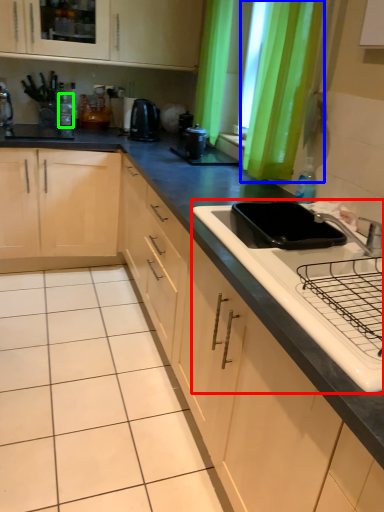
Question: Which object is the closest to the sink (highlighted by a red box)? Choose among these: curtain (highlighted by a blue box) or bottle (highlighted by a green box).

Choices:
 (A) curtain
 (B) bottle

Answer: (A)